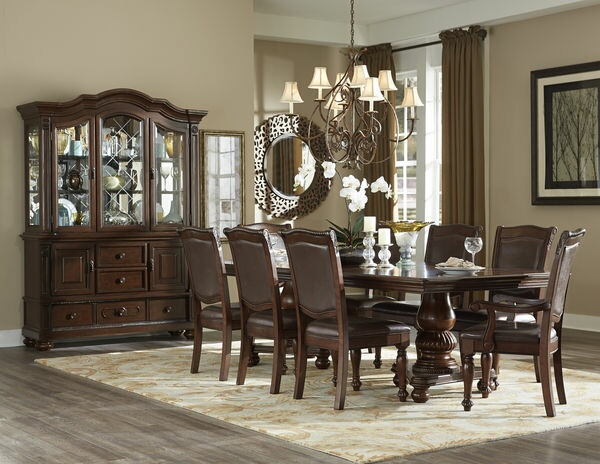
Where is `lamp shade on chandelier`? The image size is (600, 464). lamp shade on chandelier is located at coordinates (294, 91), (318, 74), (341, 80), (356, 79), (338, 97), (372, 95), (386, 79), (410, 96).